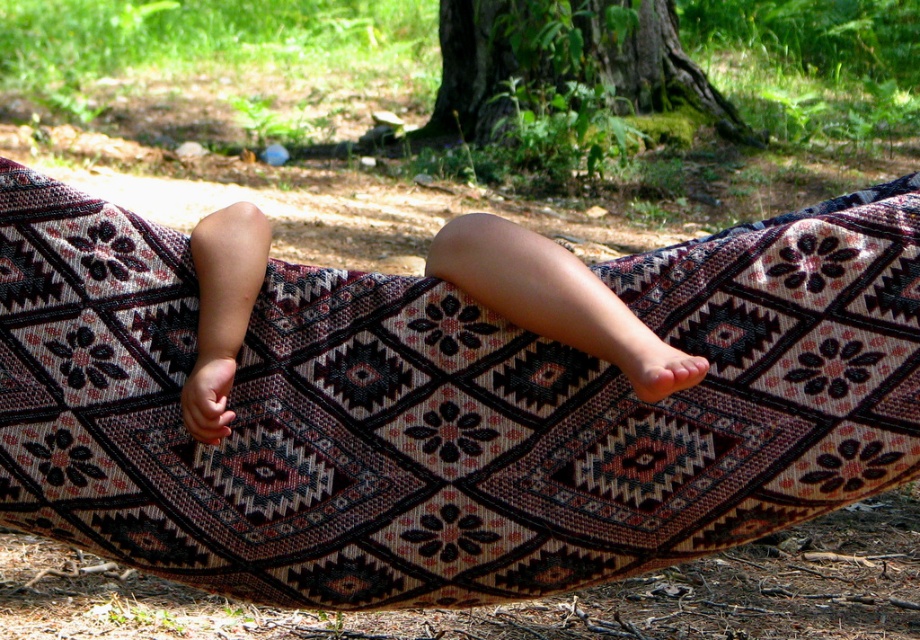
Question: Among these objects, which one is nearest to the camera?

Choices:
 (A) patterned fabric hammock at center
 (B) green mossy bark at center
 (C) smooth skin legs at center

Answer: (C)

Question: Does smooth skin legs at center appear on the left side of green mossy bark at center?

Choices:
 (A) yes
 (B) no

Answer: (A)

Question: Is patterned fabric hammock at center in front of smooth skin legs at center?

Choices:
 (A) yes
 (B) no

Answer: (B)

Question: Which point is farther to the camera?

Choices:
 (A) smooth skin legs at center
 (B) green mossy bark at center

Answer: (B)

Question: Which of the following is the farthest from the observer?

Choices:
 (A) (498, 51)
 (B) (238, 209)

Answer: (A)

Question: Does smooth skin legs at center come in front of green mossy bark at center?

Choices:
 (A) yes
 (B) no

Answer: (A)